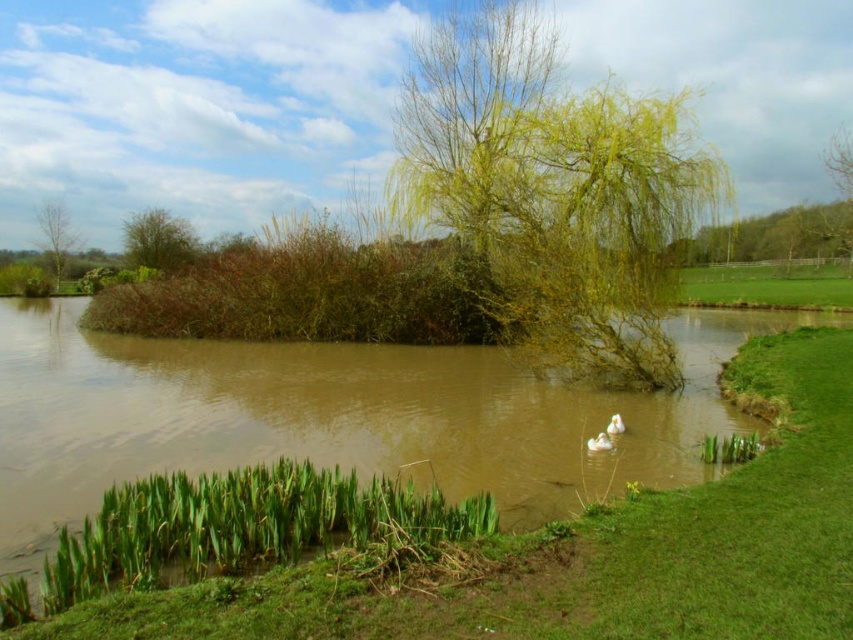
Question: Which point is closer to the camera?

Choices:
 (A) (613, 419)
 (B) (543, 241)

Answer: (A)

Question: Is green grass at center in front of white fluffy goose at center?

Choices:
 (A) yes
 (B) no

Answer: (A)

Question: Which of the following is the closest to the observer?

Choices:
 (A) (42, 218)
 (B) (613, 424)
 (C) (563, 96)
 (D) (189, 241)

Answer: (B)

Question: Is the position of green grass at center less distant than that of white fluffy goose at center?

Choices:
 (A) no
 (B) yes

Answer: (B)

Question: Is green leafy bush at upper left closer to camera compared to white fluffy goose at center?

Choices:
 (A) yes
 (B) no

Answer: (B)

Question: Which of the following is the closest to the observer?

Choices:
 (A) (569, 576)
 (B) (622, 426)

Answer: (A)